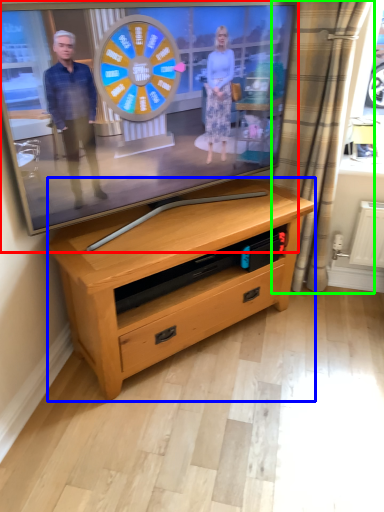
Question: Which object is the farthest from television (highlighted by a red box)? Choose among these: chest of drawers (highlighted by a blue box) or curtain (highlighted by a green box).

Choices:
 (A) chest of drawers
 (B) curtain

Answer: (B)